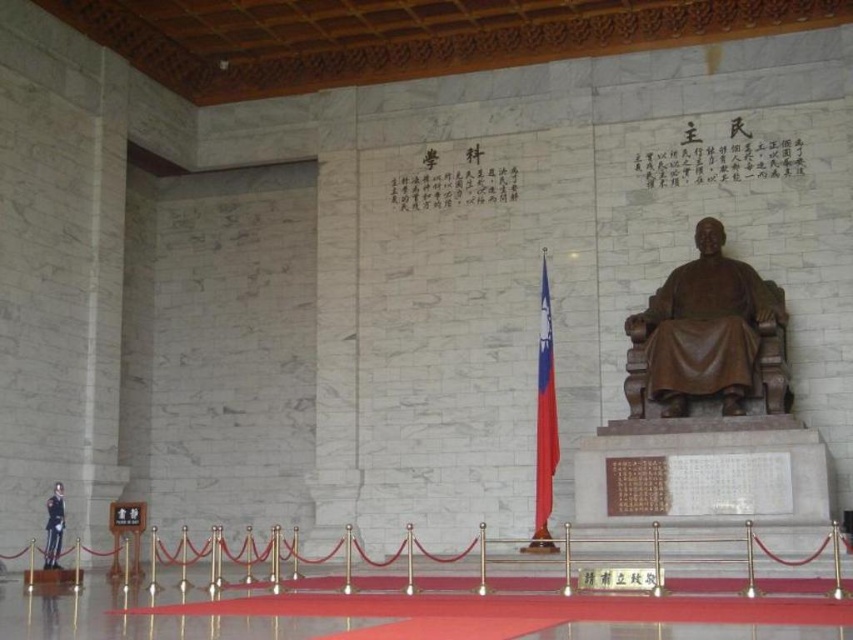
Question: Does bronze statue at center come in front of bronze statue at lower left?

Choices:
 (A) yes
 (B) no

Answer: (A)

Question: Which point is farther to the camera?

Choices:
 (A) bronze statue at lower left
 (B) bronze statue at center

Answer: (A)

Question: Which point is closer to the camera?

Choices:
 (A) bronze statue at center
 (B) bronze statue at lower left

Answer: (A)

Question: Is the position of bronze statue at center more distant than that of bronze statue at lower left?

Choices:
 (A) no
 (B) yes

Answer: (A)

Question: Observing the image, what is the correct spatial positioning of bronze statue at center in reference to bronze statue at lower left?

Choices:
 (A) left
 (B) right

Answer: (B)

Question: Estimate the real-world distances between objects in this image. Which object is farther from the bronze statue at lower left?

Choices:
 (A) bronze statue at center
 (B) red fabric flag at center

Answer: (A)